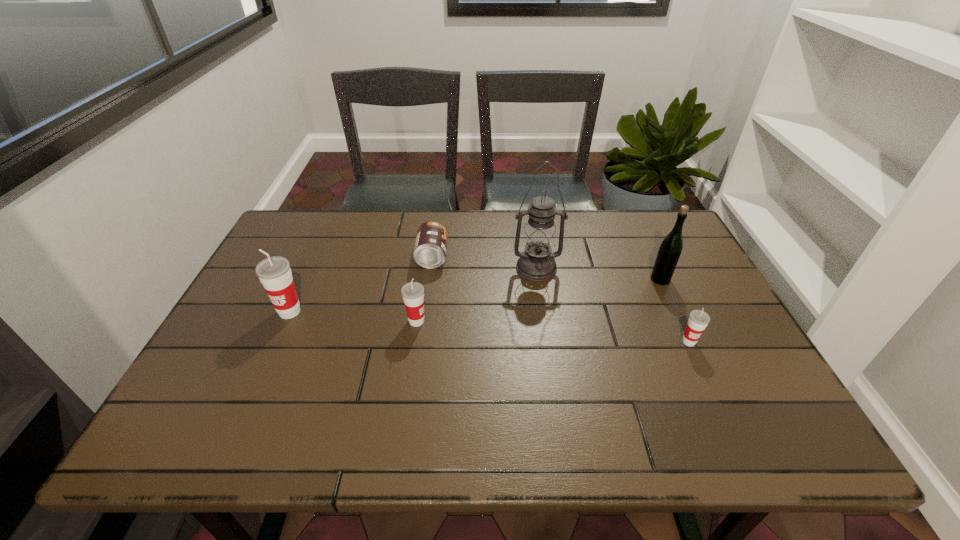
Locate an element on the screen. the leftmost cup is located at coordinates (274, 273).

Where is `the leftmost object`? the leftmost object is located at coordinates (274, 273).

You are a GUI agent. You are given a task and a screenshot of the screen. Output one action in this format:
    pyautogui.click(x=<x>, y=<y>)
    Task: Click on the third shortest object
    The image size is (960, 540).
    Given the screenshot: What is the action you would take?
    pyautogui.click(x=413, y=292)

Where is `the second cup from left to right`? This screenshot has height=540, width=960. the second cup from left to right is located at coordinates (413, 292).

You are a GUI agent. You are given a task and a screenshot of the screen. Output one action in this format:
    pyautogui.click(x=<x>, y=<y>)
    Task: Click on the fifth tallest object
    
    Given the screenshot: What is the action you would take?
    [698, 320]

Where is `the nearest object`? the nearest object is located at coordinates (698, 320).

What are the coordinates of `the tallest object` in the screenshot? It's located at (537, 263).

The image size is (960, 540). Find the location of `the fourth object from left to right`. the fourth object from left to right is located at coordinates (537, 263).

Identify the location of can. This screenshot has width=960, height=540. (430, 248).

The width and height of the screenshot is (960, 540). I want to click on beer bottle, so click(x=671, y=247).